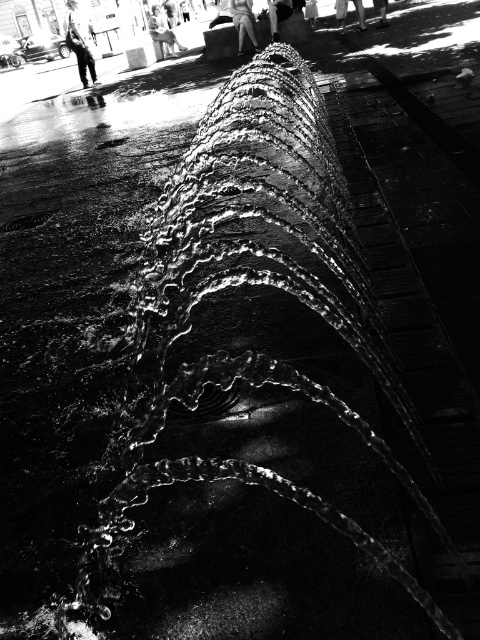
Which is more to the left, dark clothing figure at upper left or skinny jeans at lower right?

dark clothing figure at upper left is more to the left.

Is point (74, 33) behind point (382, 20)?

Yes.

Does point (74, 26) lie in front of point (379, 19)?

No, (74, 26) is behind (379, 19).

Find the location of a particular element. dark clothing figure at upper left is located at coordinates (80, 42).

Who is lower down, light skin tone clothing at upper center or smooth skin person at center?

smooth skin person at center is lower down.

Based on the photo, does light skin tone clothing at upper center have a smaller size compared to smooth skin person at center?

Indeed, light skin tone clothing at upper center has a smaller size compared to smooth skin person at center.

Who is more forward, (155, 36) or (276, 3)?

Positioned in front is point (276, 3).

The height and width of the screenshot is (640, 480). What are the coordinates of `light skin tone clothing at upper center` in the screenshot? It's located at (163, 33).

Does dark clothing figure at upper left have a greater width compared to smooth skin person at center?

Correct, the width of dark clothing figure at upper left exceeds that of smooth skin person at center.

Is dark clothing figure at upper left above smooth skin person at center?

Correct, dark clothing figure at upper left is located above smooth skin person at center.

Describe the element at coordinates (80, 42) in the screenshot. I see `dark clothing figure at upper left` at that location.

Identify the location of dark clothing figure at upper left. (80, 42).